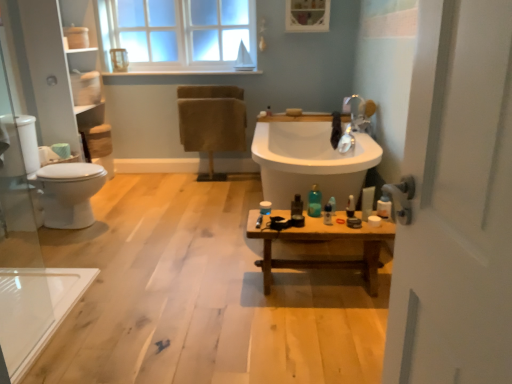
Where is `vacant space underneath beige fabric chair at upper center (from a real-world perspective)`? vacant space underneath beige fabric chair at upper center (from a real-world perspective) is located at coordinates (218, 173).